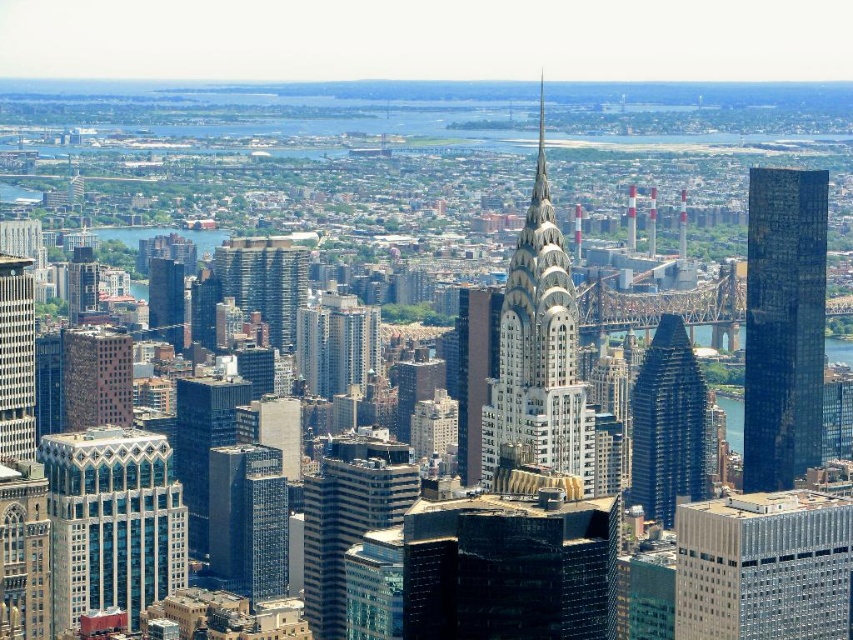
Question: Considering the relative positions of clear glass skyscraper at center and glassy reflective skyscraper at left in the image provided, where is clear glass skyscraper at center located with respect to glassy reflective skyscraper at left?

Choices:
 (A) below
 (B) above

Answer: (A)

Question: Which point is farther from the camera taking this photo?

Choices:
 (A) (833, 499)
 (B) (747, 420)
 (C) (627, 218)

Answer: (A)

Question: Which point is closer to the camera?

Choices:
 (A) silver metallic building at lower right
 (B) smooth silver spire at center
 (C) black glass skyscraper at right
 (D) metallic glass skyscraper at center-left

Answer: (B)

Question: Which point appears closest to the camera in this image?

Choices:
 (A) (633, 218)
 (B) (703, 444)

Answer: (A)

Question: Does silver metallic building at lower right come behind shiny silver skyscraper at center?

Choices:
 (A) yes
 (B) no

Answer: (A)

Question: Does glossy glass skyscraper at center-right have a smaller size compared to shiny glass skyscraper at center?

Choices:
 (A) yes
 (B) no

Answer: (B)